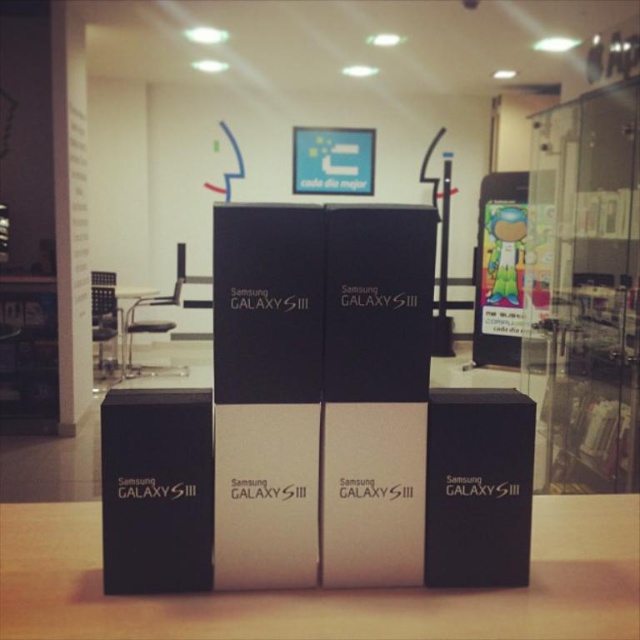
Who is positioned more to the right, black matte galaxy s iii boxes at center or metallic silver table at left?

black matte galaxy s iii boxes at center

Is black matte galaxy s iii boxes at center smaller than metallic silver table at left?

Indeed, black matte galaxy s iii boxes at center has a smaller size compared to metallic silver table at left.

This screenshot has width=640, height=640. I want to click on black matte galaxy s iii boxes at center, so click(328, 589).